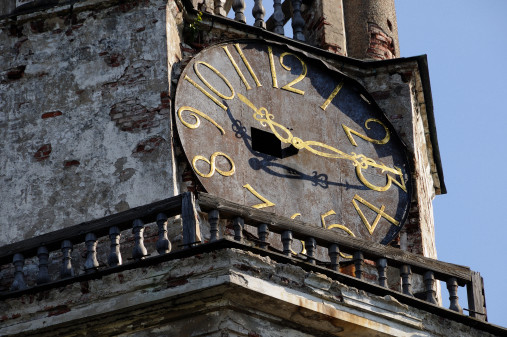
You are a GUI agent. You are given a task and a screenshot of the screen. Output one action in this format:
    pyautogui.click(x=<x>, y=<y>)
    Task: Click on the clock
    The width and height of the screenshot is (507, 337).
    Given the screenshot: What is the action you would take?
    (x=336, y=192)